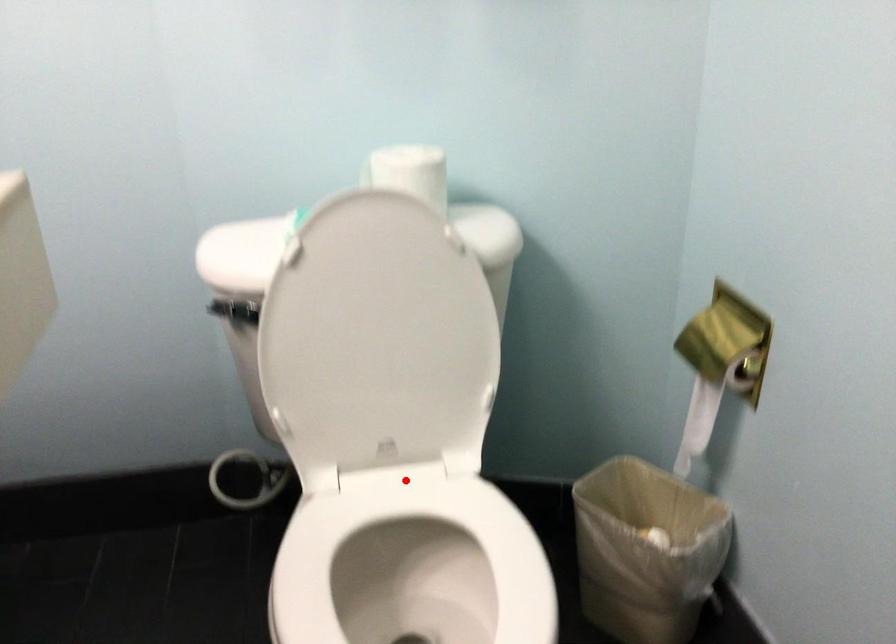
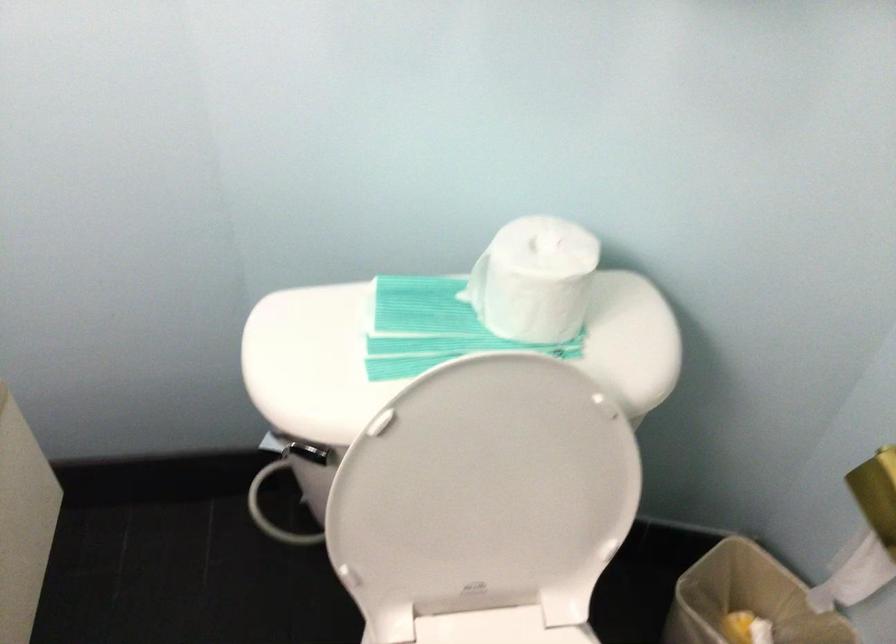
Find the pixel in the second image that matches the highlighted location in the first image.

(497, 627)